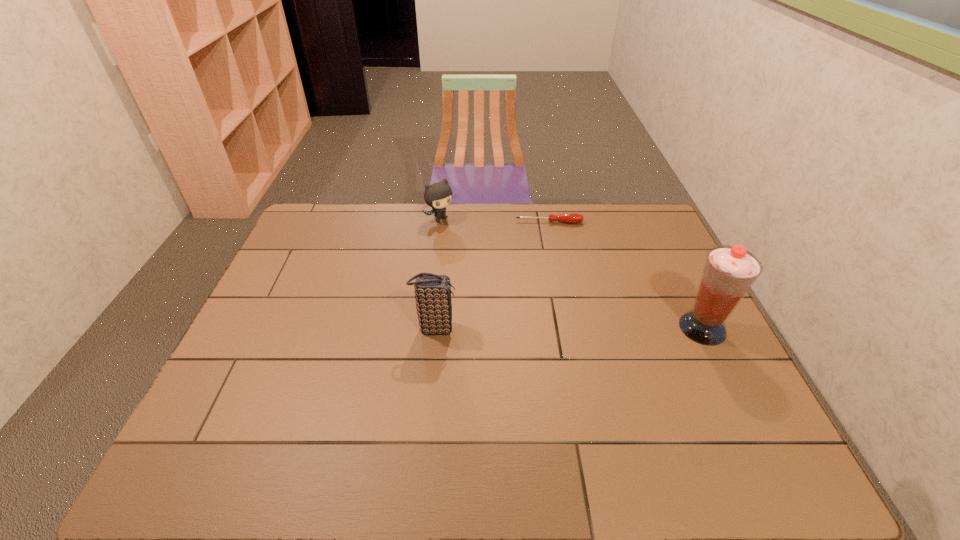
The height and width of the screenshot is (540, 960). I want to click on free space at the right edge of the desktop, so click(657, 317).

Where is `vacant space at the far right corner of the desktop`? vacant space at the far right corner of the desktop is located at coordinates (640, 221).

This screenshot has height=540, width=960. I want to click on vacant area that lies between the shortest object and the smoothie, so click(626, 275).

I want to click on free space between the clutch bag and the tallest object, so click(x=568, y=328).

The width and height of the screenshot is (960, 540). I want to click on free space between the third shortest object and the screwdriver, so click(x=492, y=275).

What are the coordinates of `vacant region between the screwdriver and the kitten` in the screenshot? It's located at (495, 221).

Locate an element on the screen. Image resolution: width=960 pixels, height=540 pixels. vacant space that is in between the third tallest object and the clutch bag is located at coordinates (439, 274).

This screenshot has height=540, width=960. What are the coordinates of `free space between the rightmost object and the shortest object` in the screenshot? It's located at (626, 275).

Identify the location of free area in between the clutch bag and the screwdriver. The width and height of the screenshot is (960, 540). (492, 275).

At what (x,y) coordinates should I click in order to perform the action: click on vacant point located between the third shortest object and the smoothie. Please return your answer as a coordinate pair (x, y). Looking at the image, I should click on (568, 328).